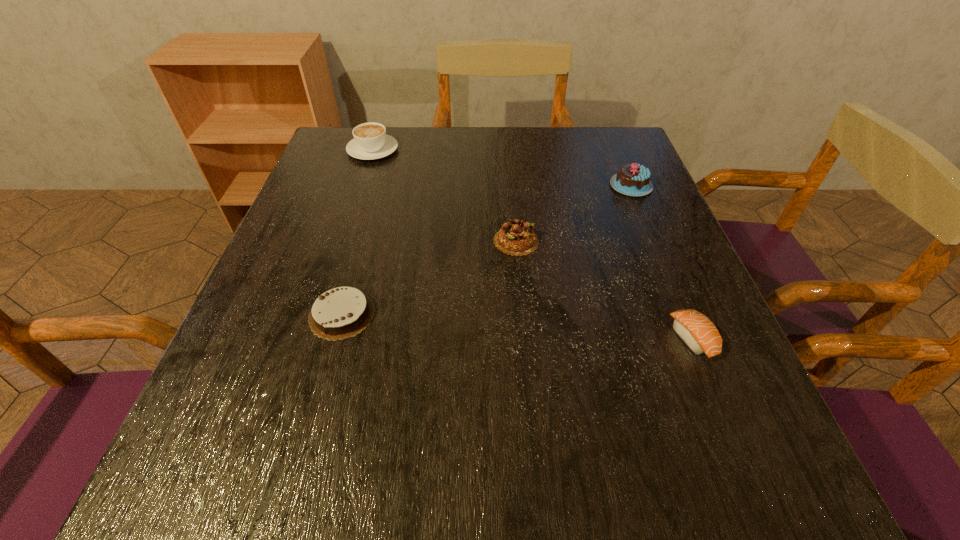
Identify the location of the farthest object. The image size is (960, 540). (370, 141).

At what (x,y) coordinates should I click in order to perform the action: click on the tallest chocolate cake. Please return your answer as a coordinate pair (x, y). This screenshot has width=960, height=540. Looking at the image, I should click on (632, 179).

At what (x,y) coordinates should I click in order to perform the action: click on the second farthest object. Please return your answer as a coordinate pair (x, y). Looking at the image, I should click on (632, 179).

The image size is (960, 540). In order to click on the third nearest object in this screenshot , I will do `click(516, 237)`.

The image size is (960, 540). Identify the location of the second tallest chocolate cake. (516, 237).

The image size is (960, 540). In order to click on sushi in this screenshot , I will do `click(695, 329)`.

Locate an element on the screen. the leftmost chocolate cake is located at coordinates (343, 312).

Locate an element on the screen. The image size is (960, 540). the nearest chocolate cake is located at coordinates (343, 312).

The width and height of the screenshot is (960, 540). I want to click on free space located on the front of the tallest chocolate cake, so click(688, 325).

Where is `vacant region located 0.150m on the back of the second nearest chocolate cake`? vacant region located 0.150m on the back of the second nearest chocolate cake is located at coordinates (512, 187).